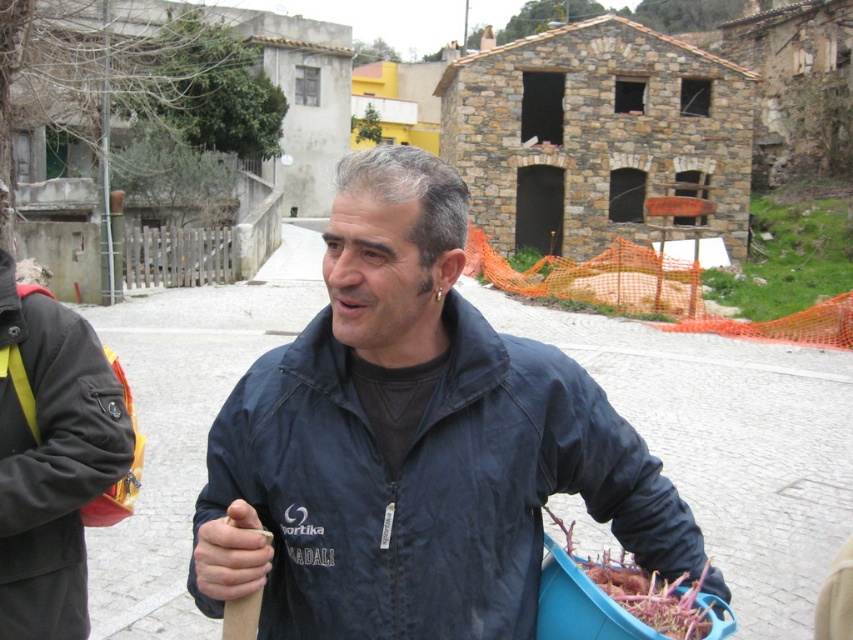
Based on the photo, is dark blue jacket at center to the left of black fleece jacket at left from the viewer's perspective?

Incorrect, dark blue jacket at center is not on the left side of black fleece jacket at left.

Can you confirm if dark blue jacket at center is positioned above black fleece jacket at left?

Indeed, dark blue jacket at center is positioned over black fleece jacket at left.

Image resolution: width=853 pixels, height=640 pixels. In order to click on dark blue jacket at center in this screenshot , I will do `click(412, 444)`.

Does black fleece jacket at left have a greater height compared to brown fibrous roots at lower center?

Indeed, black fleece jacket at left has a greater height compared to brown fibrous roots at lower center.

Which is in front, point (28, 595) or point (659, 604)?

Point (659, 604) is in front.

What do you see at coordinates (51, 461) in the screenshot? Image resolution: width=853 pixels, height=640 pixels. I see `black fleece jacket at left` at bounding box center [51, 461].

You are a GUI agent. You are given a task and a screenshot of the screen. Output one action in this format:
    pyautogui.click(x=<x>, y=<y>)
    Task: Click on the black fleece jacket at left
    
    Given the screenshot: What is the action you would take?
    pyautogui.click(x=51, y=461)

Consider the image. Is dark blue jacket at center wider than brown fibrous roots at lower center?

Indeed, dark blue jacket at center has a greater width compared to brown fibrous roots at lower center.

Locate an element on the screen. The image size is (853, 640). dark blue jacket at center is located at coordinates (412, 444).

Locate an element on the screen. The height and width of the screenshot is (640, 853). dark blue jacket at center is located at coordinates (412, 444).